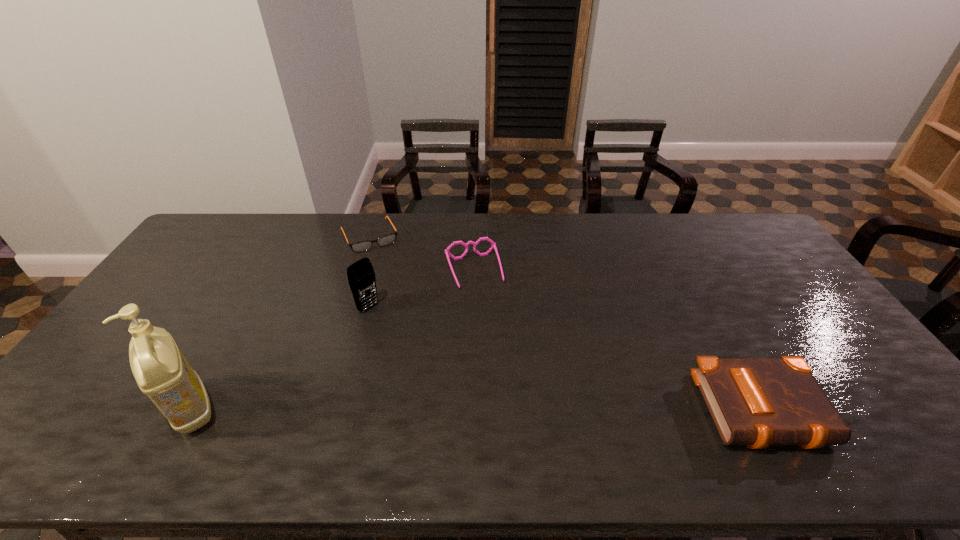
This screenshot has width=960, height=540. What are the coordinates of `vacant area that lies between the shortest object and the taller spectacles` in the screenshot? It's located at (421, 254).

Identify the location of free spot between the taller spectacles and the rightmost object. Image resolution: width=960 pixels, height=540 pixels. (619, 341).

Identify the location of vacant area that lies between the tallest object and the second object from right to left. This screenshot has height=540, width=960. (332, 340).

In order to click on free area in between the detergent and the second tallest object in this screenshot , I will do `click(280, 358)`.

Where is `free space between the right spectacles and the rightmost object`? free space between the right spectacles and the rightmost object is located at coordinates (619, 341).

The height and width of the screenshot is (540, 960). I want to click on vacant area that lies between the taller spectacles and the shorter spectacles, so click(421, 254).

Locate an element on the screen. This screenshot has width=960, height=540. blank region between the right spectacles and the cellular telephone is located at coordinates (421, 289).

This screenshot has width=960, height=540. What are the coordinates of `object that stands as the closest to the shortest object` in the screenshot? It's located at (493, 245).

Locate an element on the screen. object that ranks as the closest to the taller spectacles is located at coordinates (361, 246).

Locate an element on the screen. This screenshot has height=540, width=960. free spot that satisfies the following two spatial constraints: 1. on the front side of the left spectacles; 2. on the left side of the third nearest object is located at coordinates (347, 307).